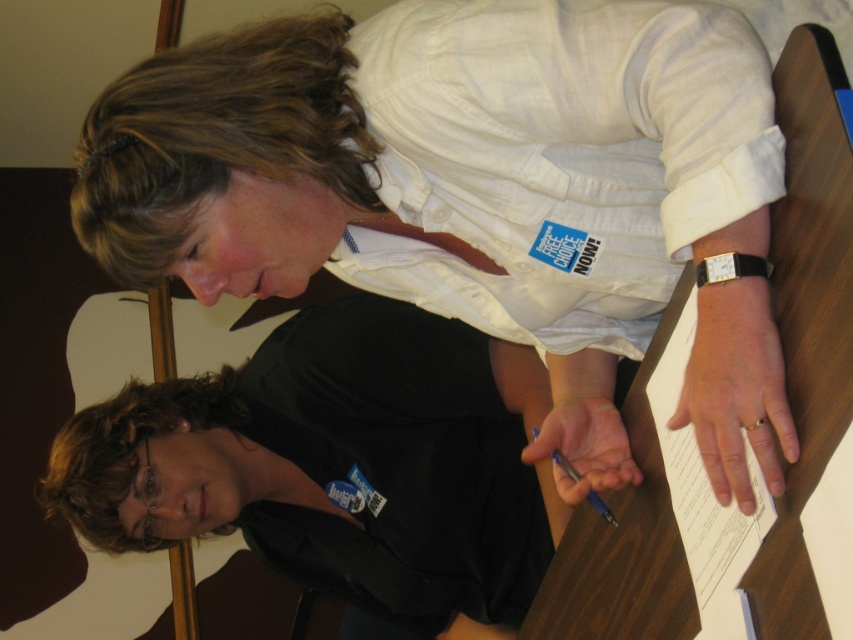
Question: Is white cotton shirt at upper center in front of wooden table at center?

Choices:
 (A) yes
 (B) no

Answer: (B)

Question: Which object is farther from the camera taking this photo?

Choices:
 (A) wooden table at center
 (B) white cotton shirt at upper center
 (C) black matte shirt at center

Answer: (C)

Question: Can you confirm if white paper at right is wider than blue metallic pen at lower center?

Choices:
 (A) no
 (B) yes

Answer: (A)

Question: Estimate the real-world distances between objects in this image. Which object is closer to the white cotton shirt at upper center?

Choices:
 (A) black matte shirt at center
 (B) blue metallic pen at lower center
 (C) wooden table at center

Answer: (C)

Question: Can you confirm if white cotton shirt at upper center is positioned to the right of blue metallic pen at lower center?

Choices:
 (A) yes
 (B) no

Answer: (B)

Question: Considering the real-world distances, which object is farthest from the white cotton shirt at upper center?

Choices:
 (A) black matte shirt at center
 (B) wooden table at center

Answer: (A)